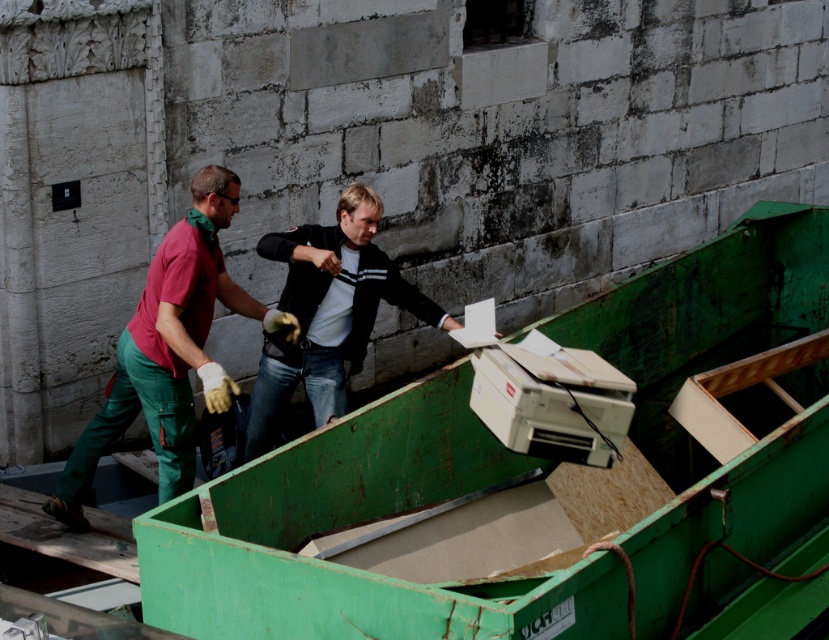
You are standing at the point with coordinates (168, 349) in the image. What object are you standing on?

The point with coordinates (168, 349) is on the matte green jumpsuit at center.